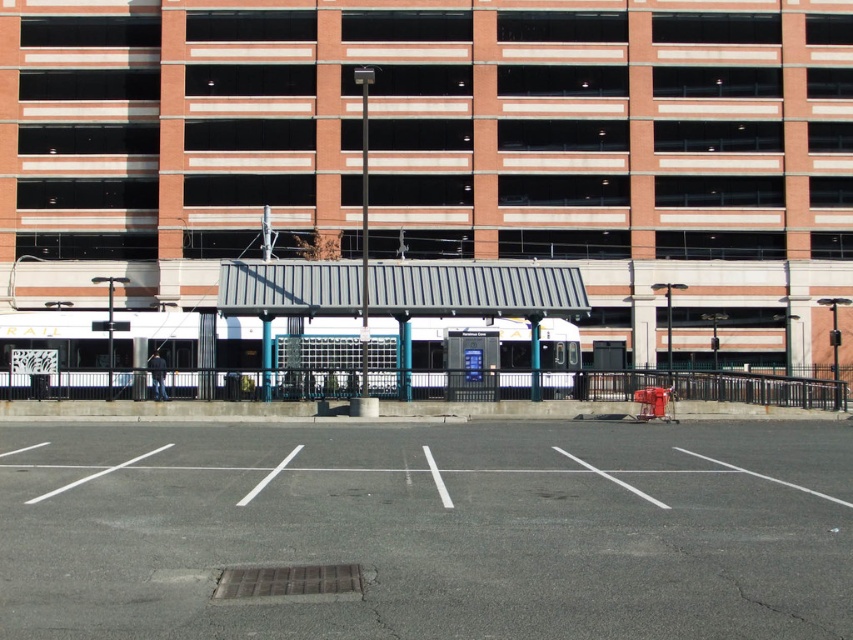
What are the coordinates of the brick parking garage at center?

The brick parking garage at center is located at coordinates point (444, 150).